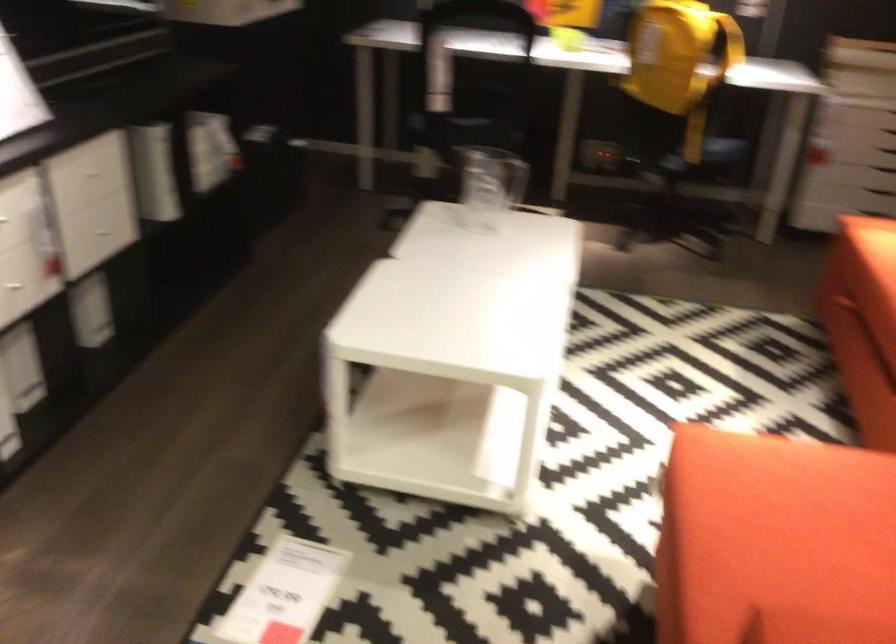
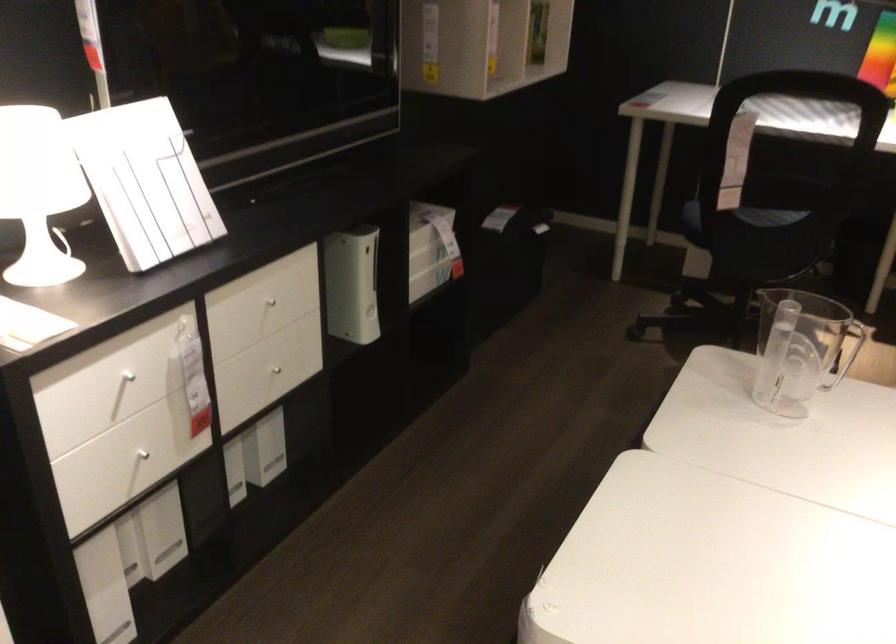
In the second image, find the point that corresponds to point (445, 118) in the first image.

(739, 218)